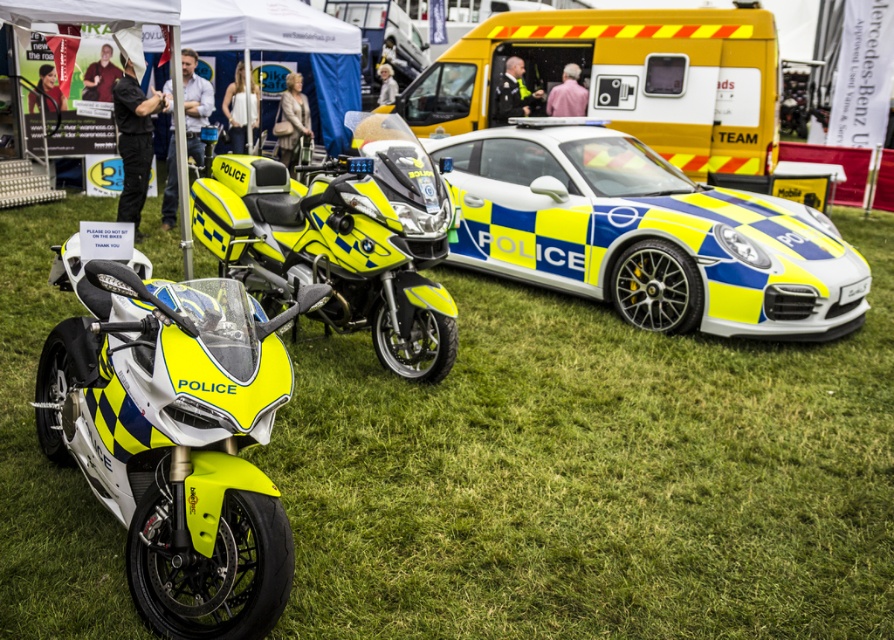
Is point (724, 468) closer to viewer compared to point (94, 352)?

That is False.

Is green grass at center to the left of yellow matte police motorcycle at left from the viewer's perspective?

Incorrect, green grass at center is not on the left side of yellow matte police motorcycle at left.

The height and width of the screenshot is (640, 894). I want to click on green grass at center, so click(592, 476).

The width and height of the screenshot is (894, 640). I want to click on green grass at center, so click(x=592, y=476).

Consider the image. Measure the distance between green grass at center and camera.

They are 3.22 meters apart.

Can you confirm if green grass at center is positioned below yellow matte van at center?

Yes.

Is point (867, 296) in front of point (755, 156)?

Yes, point (867, 296) is closer to viewer.

Find the location of a particular element. green grass at center is located at coordinates (592, 476).

Between yellow/blue checkered police car at center and yellowmattemotorcycle at center, which one has less height?

Standing shorter between the two is yellowmattemotorcycle at center.

Who is more forward, (637,246) or (361,275)?

Point (361,275)

You are a GUI agent. You are given a task and a screenshot of the screen. Output one action in this format:
    pyautogui.click(x=<x>, y=<y>)
    Task: Click on the yellow/blue checkered police car at center
    
    Given the screenshot: What is the action you would take?
    pyautogui.click(x=646, y=234)